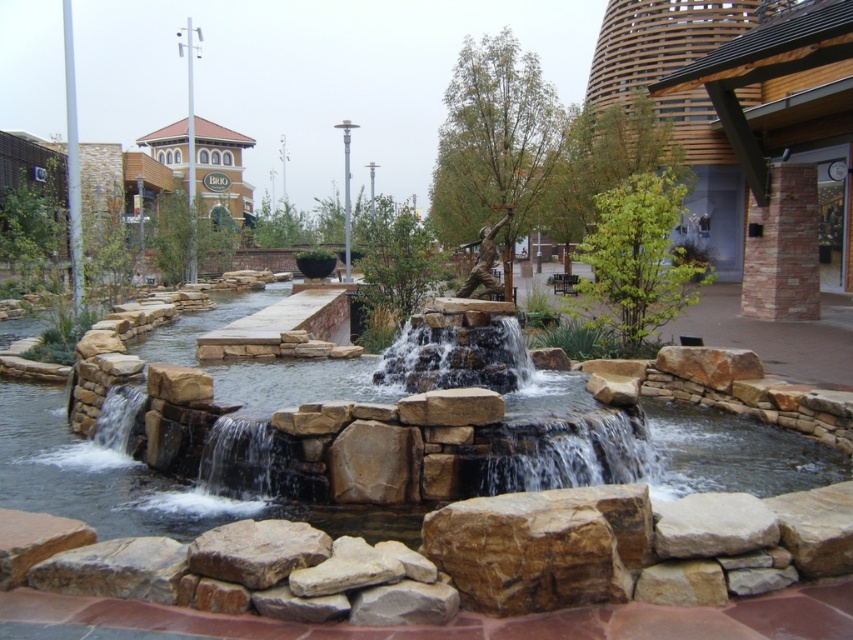
Question: Estimate the real-world distances between objects in this image. Which object is farther from the brown rough rock at center?

Choices:
 (A) brown stone waterfall at center
 (B) smooth stone waterfall at lower left
 (C) brown stone stream at center

Answer: (B)

Question: Does brown stone stream at center have a larger size compared to smooth stone waterfall at lower left?

Choices:
 (A) no
 (B) yes

Answer: (B)

Question: Which point is closer to the camera?

Choices:
 (A) (122, 396)
 (B) (192, 541)
 (C) (566, 396)

Answer: (B)

Question: Which of the following is the closest to the observer?

Choices:
 (A) brown stone waterfall at center
 (B) brown stone stream at center

Answer: (B)

Question: Is brown stone waterfall at center smaller than brown rough rock at center?

Choices:
 (A) no
 (B) yes

Answer: (A)

Question: Does brown stone stream at center appear on the right side of smooth stone waterfall at lower left?

Choices:
 (A) no
 (B) yes

Answer: (B)